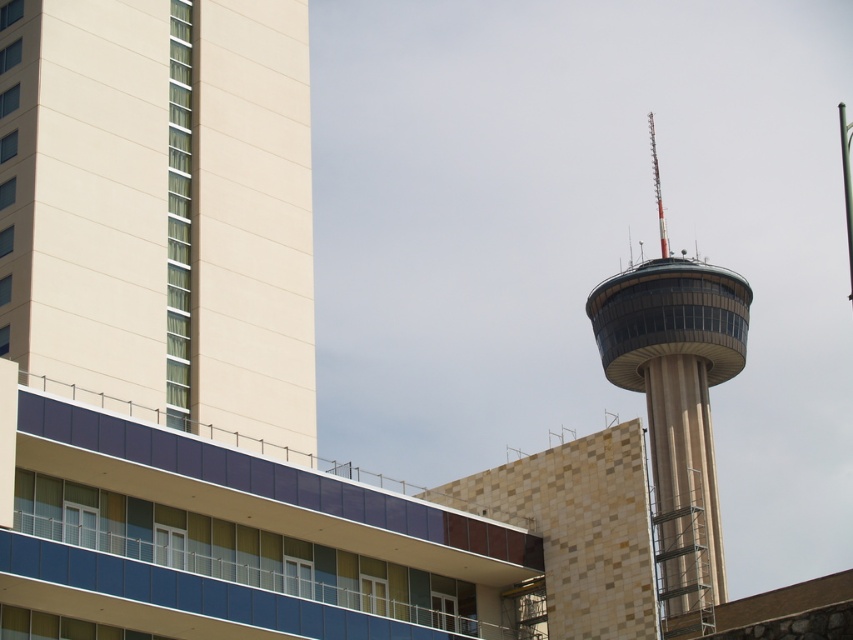
Can you confirm if beige concrete tower at left is positioned to the left of beige stone tower at right?

Correct, you'll find beige concrete tower at left to the left of beige stone tower at right.

Is point (117, 112) more distant than point (607, 280)?

No.

Locate an element on the screen. Image resolution: width=853 pixels, height=640 pixels. beige concrete tower at left is located at coordinates (161, 205).